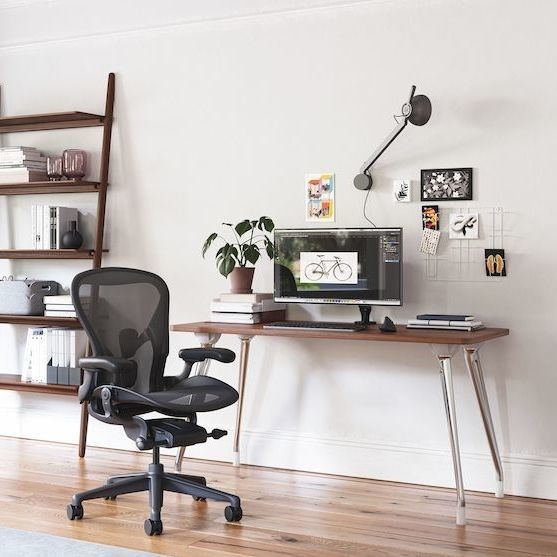
The image size is (557, 557). Find the location of `monitor`. monitor is located at coordinates (377, 273).